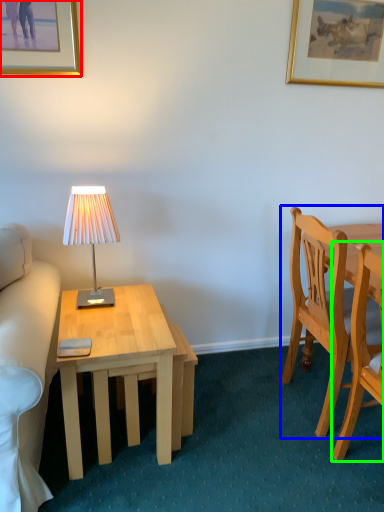
Question: Which object is the farthest from picture frame (highlighted by a red box)? Choose among these: chair (highlighted by a blue box) or chair (highlighted by a green box).

Choices:
 (A) chair
 (B) chair

Answer: (B)